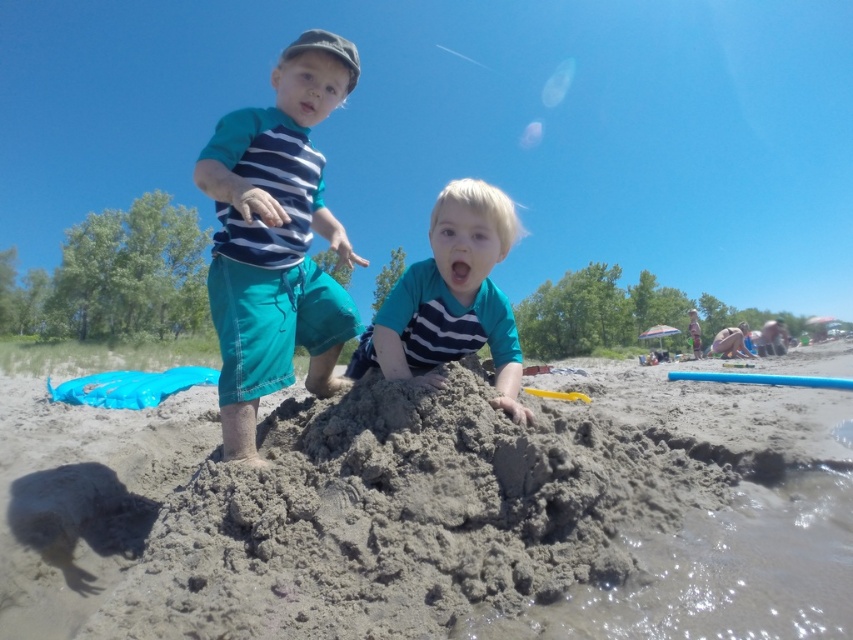
In the scene shown: You are a photographer standing at the beach and want to capture both the gray sandcastle at center and the matte blue shorts at center in a single frame. Based on their sizes, which object should you focus on to ensure both are fully visible in the photo?

The gray sandcastle at center is wider than the matte blue shorts at center, so focusing on the gray sandcastle at center would ensure both objects are fully visible in the photo.

You are a photographer trying to capture a candid shot of the children. You notice the matte blue shorts at center and the matte teal shirt at center. Which one is positioned higher in the image?

The matte blue shorts at center is located above the matte teal shirt at center, so it is positioned higher in the image.